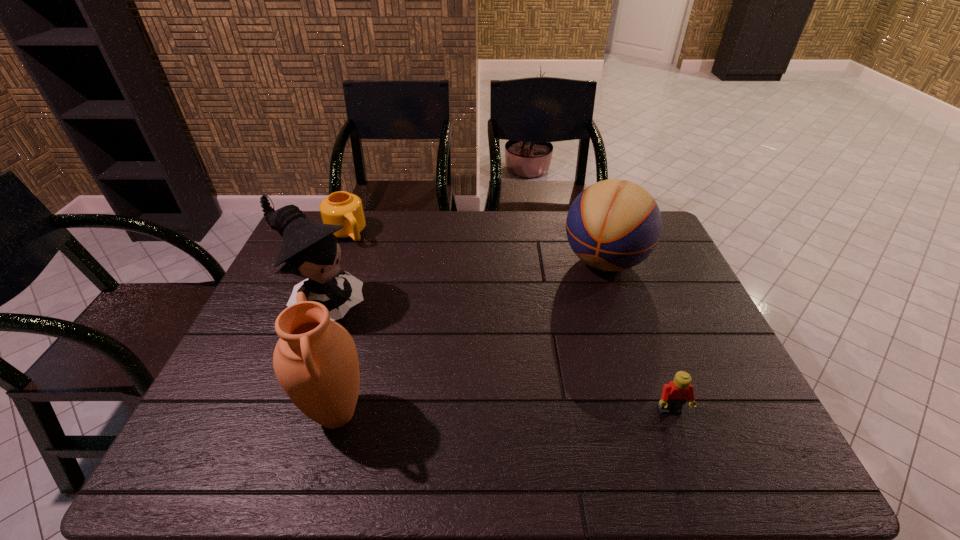
Identify the location of free space on the desktop that is between the urn and the Lego and is positioned at the face of the doll. The image size is (960, 540). (484, 413).

Identify the location of vacant space on the desktop that is between the urn and the Lego and is positioned on the patterned surface of the basketball. This screenshot has height=540, width=960. pyautogui.click(x=517, y=412).

The height and width of the screenshot is (540, 960). In order to click on vacant space on the desktop that is between the urn and the Lego and is positioned on the handle side of the mug in this screenshot , I will do `click(484, 413)`.